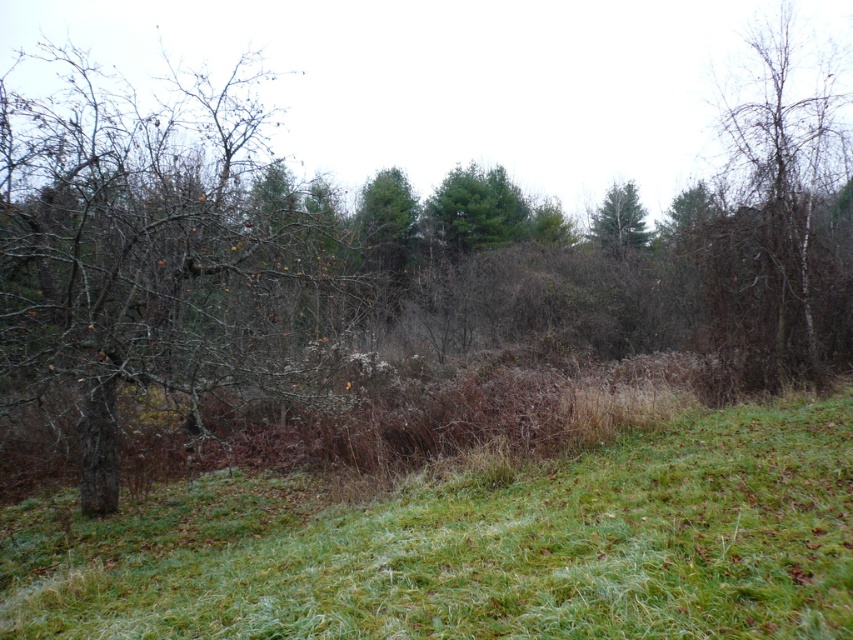
You are standing at the point marked as point (474, 547) in the image. What do you see directly beneath your feet?

You see green grass at center directly beneath your feet at point (474, 547).